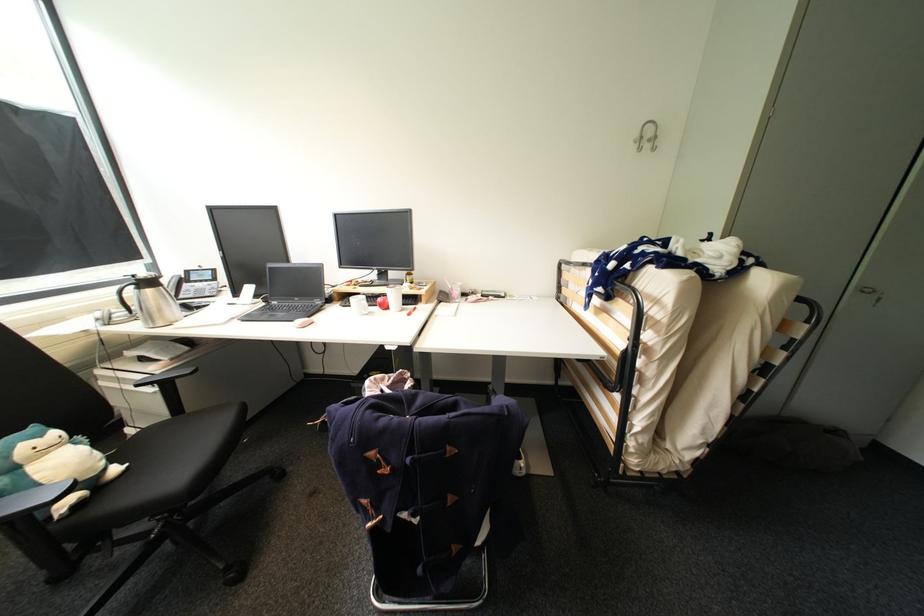
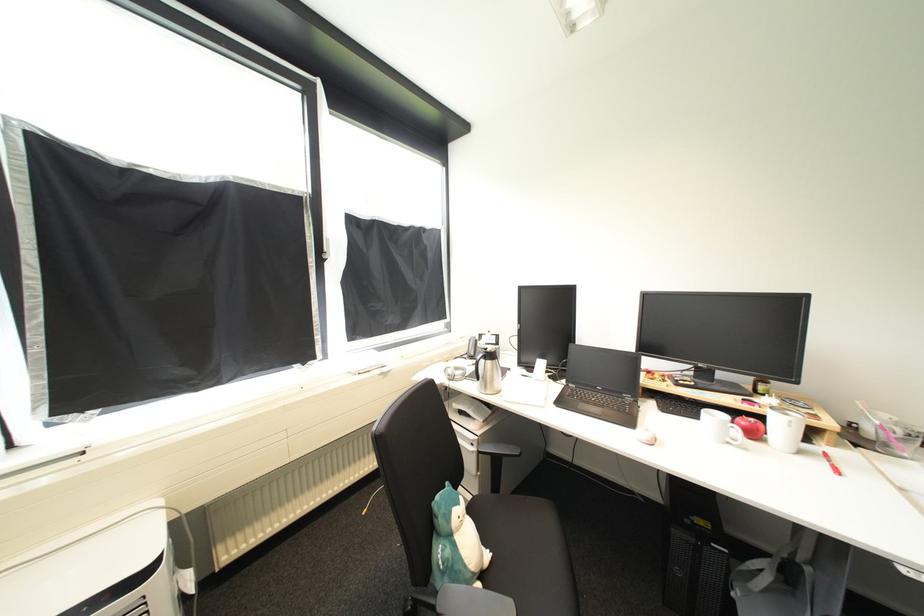
In the second image, find the point that corresponds to (x=112, y=326) in the first image.

(456, 381)